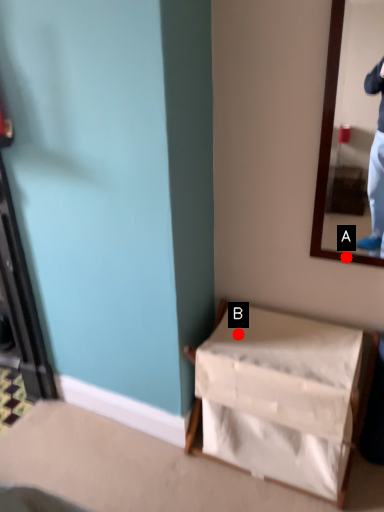
Question: Two points are circled on the image, labeled by A and B beside each circle. Which of the following is the closest to the observer?

Choices:
 (A) A is closer
 (B) B is closer

Answer: (A)